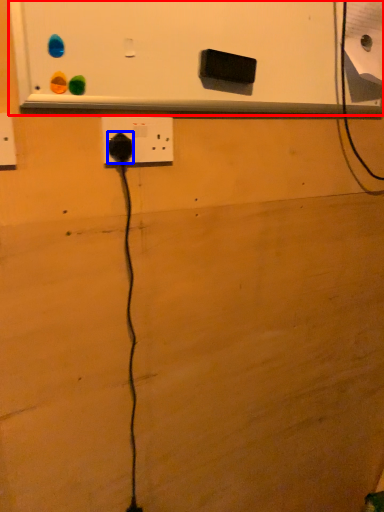
Question: Which point is closer to the camera, bulletin board (highlighted by a red box) or power plugs and sockets (highlighted by a blue box)?

Choices:
 (A) bulletin board
 (B) power plugs and sockets

Answer: (A)